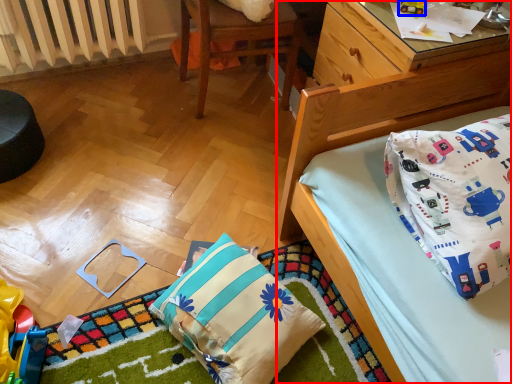
Question: Which object is closer to the camera taking this photo, bed (highlighted by a red box) or toy (highlighted by a blue box)?

Choices:
 (A) bed
 (B) toy

Answer: (A)